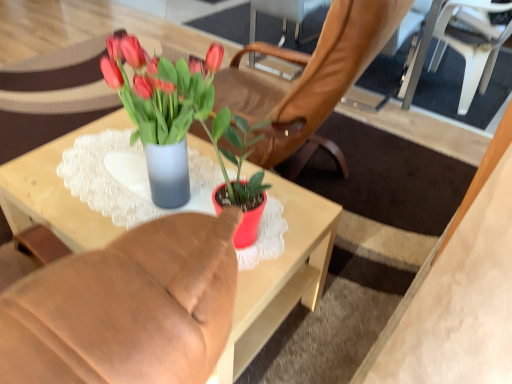
Locate an element on the screen. The width and height of the screenshot is (512, 384). vacant region above matte glass vase at center (from a real-world perspective) is located at coordinates (128, 180).